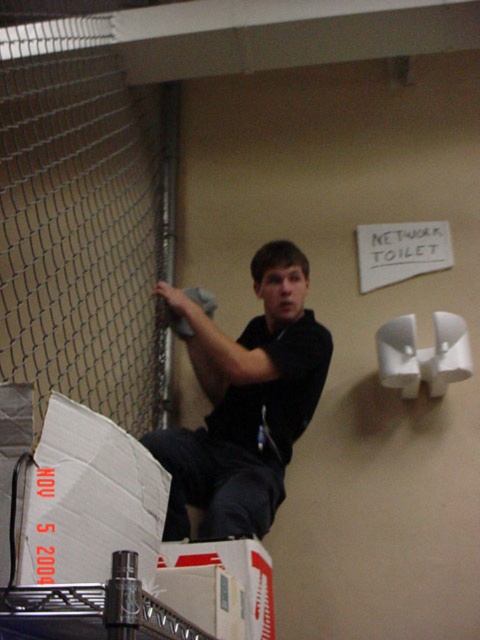
Where is the black matte shirt at upper center located in the image?

The black matte shirt at upper center is located at point (244, 403).

You are a delivery person who just arrived at the storage room. You see a black matte shirt at upper center and a white cardboard box at lower center. Which object is closer to the right side of the room?

The black matte shirt at upper center is positioned on the right side of white cardboard box at lower center, so it is closer to the right side of the room.

You are a delivery person who just arrived at the storage room. You need to place a new box on the shelf above the white cardboard box at lower center. Is the black matte shirt at upper center in the way of placing the box?

The black matte shirt at upper center is located above the white cardboard box at lower center, so it is in the way of placing the new box on the shelf above.